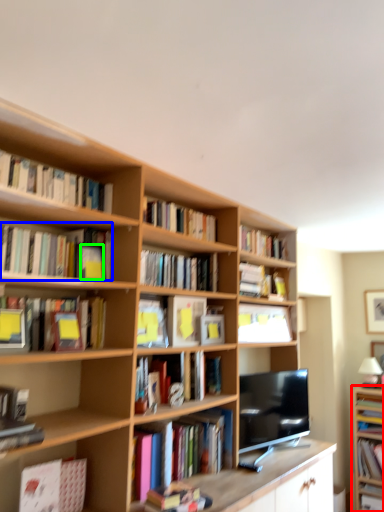
Question: Which object is positioned closest to bookcase (highlighted by a red box)? Select from book (highlighted by a blue box) and paperback book (highlighted by a green box).

Choices:
 (A) book
 (B) paperback book

Answer: (B)